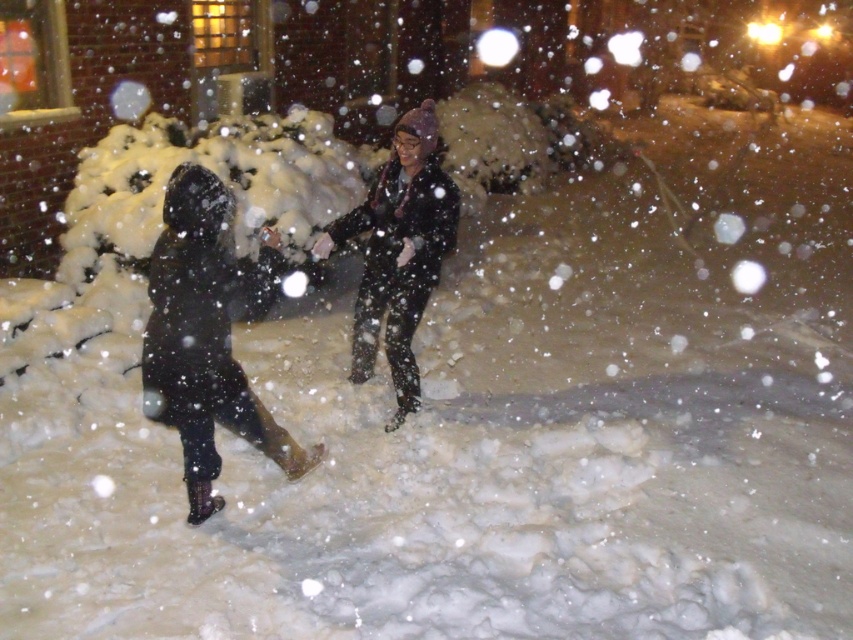
You are a photographer trying to capture a photo of both the black matte coat at left and the matte black jacket at center. Which clothing item is positioned to the left of the other?

The black matte coat at left is positioned on the left side of matte black jacket at center.